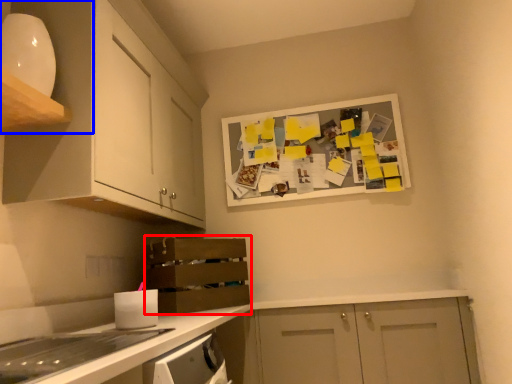
Question: Among these objects, which one is farthest to the camera, shelf (highlighted by a red box) or cabinetry (highlighted by a blue box)?

Choices:
 (A) shelf
 (B) cabinetry

Answer: (A)